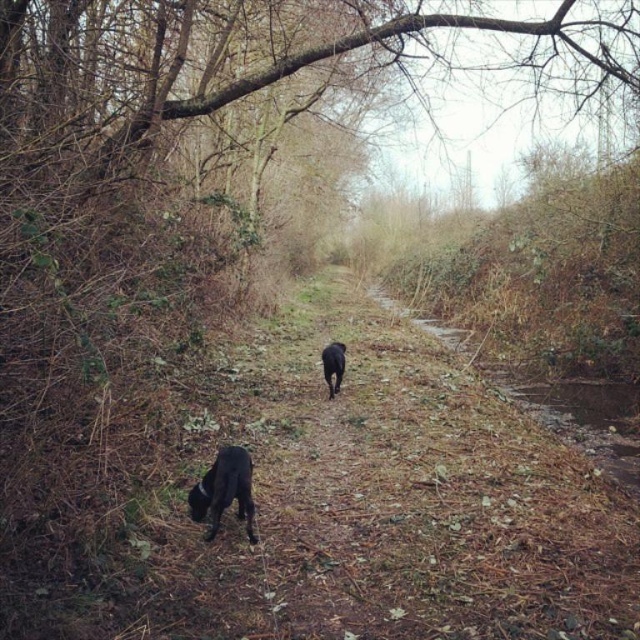
Question: Which point is closer to the camera?

Choices:
 (A) (330, 349)
 (B) (225, 488)

Answer: (B)

Question: Is black matte dog at lower left thinner than black matte dog at center?

Choices:
 (A) yes
 (B) no

Answer: (B)

Question: Does black matte dog at lower left come behind black matte dog at center?

Choices:
 (A) no
 (B) yes

Answer: (A)

Question: Which of the following is the closest to the observer?

Choices:
 (A) (337, 387)
 (B) (240, 476)

Answer: (B)

Question: Which of the following is the closest to the observer?

Choices:
 (A) black matte dog at lower left
 (B) black matte dog at center

Answer: (A)

Question: Can you confirm if black matte dog at lower left is smaller than black matte dog at center?

Choices:
 (A) no
 (B) yes

Answer: (B)